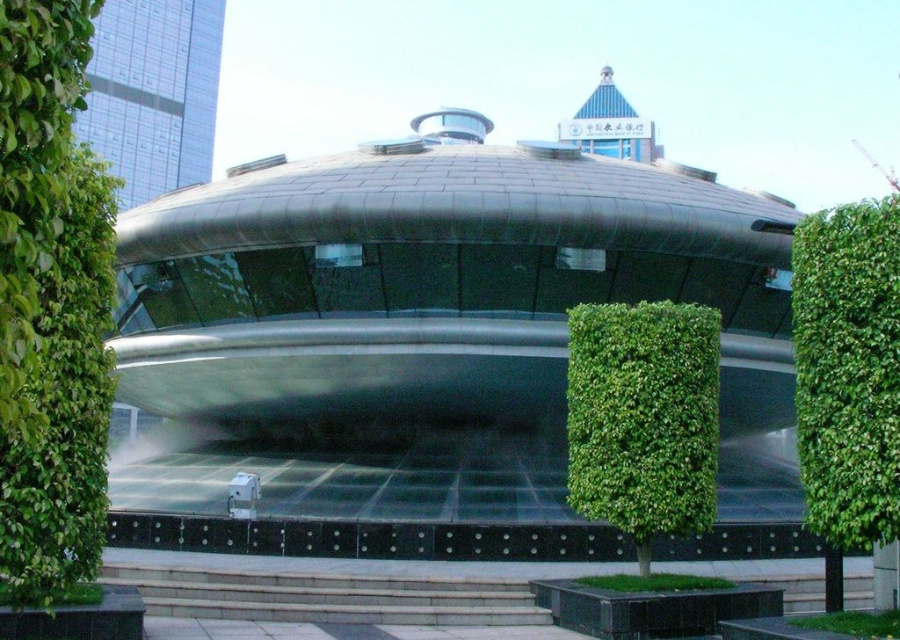
Question: Is green leafy tree at left closer to camera compared to green leafy hedge at center?

Choices:
 (A) yes
 (B) no

Answer: (A)

Question: Which object is the closest to the green leafy hedge at center?

Choices:
 (A) green leafy bush at center
 (B) green leafy tree at left

Answer: (A)

Question: Which point is closer to the camera taking this photo?

Choices:
 (A) (695, 305)
 (B) (108, 368)
 (C) (861, 316)

Answer: (C)

Question: Is green leafy tree at left to the left of green leafy hedge at center from the viewer's perspective?

Choices:
 (A) no
 (B) yes

Answer: (B)

Question: Which of these objects is positioned farthest from the green leafy bush at center?

Choices:
 (A) green leafy tree at left
 (B) green leafy hedge at center

Answer: (A)

Question: From the image, what is the correct spatial relationship of green leafy tree at left in relation to green leafy hedge at center?

Choices:
 (A) right
 (B) left

Answer: (B)